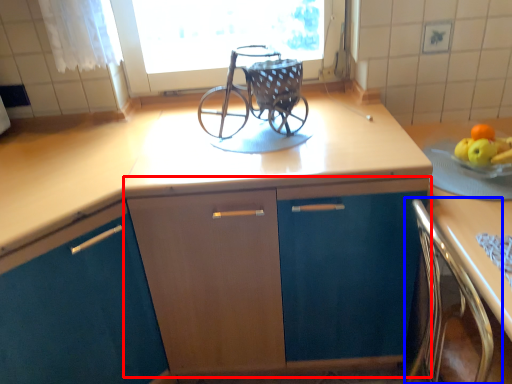
Question: Which point is further to the camera, cabinetry (highlighted by a red box) or chair (highlighted by a blue box)?

Choices:
 (A) cabinetry
 (B) chair

Answer: (A)